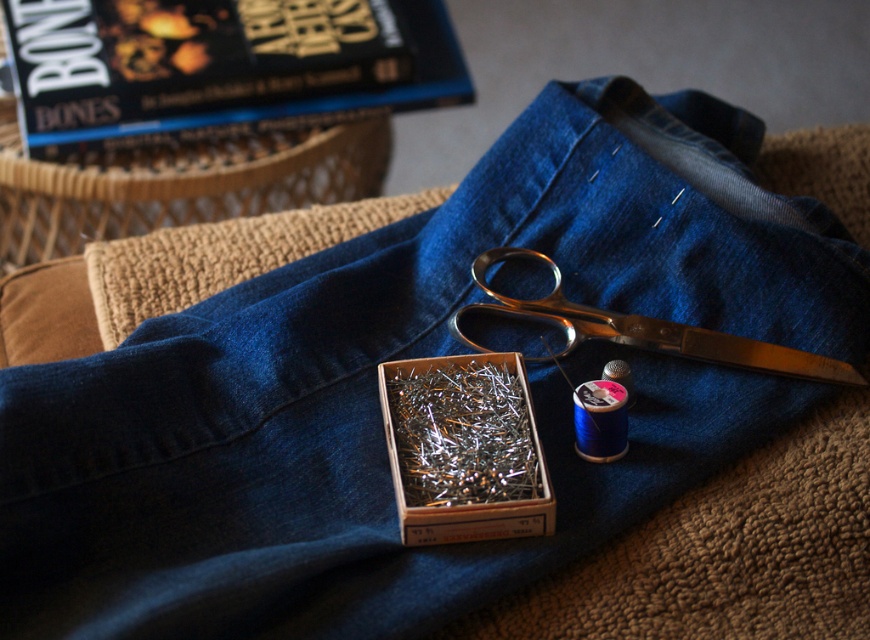
Question: Which of the following is the closest to the observer?

Choices:
 (A) wooden box filled with pins at center
 (B) polished metal scissors at center

Answer: (A)

Question: Which object is closer to the camera taking this photo?

Choices:
 (A) polished metal scissors at center
 (B) wooden box filled with pins at center

Answer: (B)

Question: Is wooden box filled with pins at center positioned before polished metal scissors at center?

Choices:
 (A) yes
 (B) no

Answer: (A)

Question: Does wooden box filled with pins at center have a greater width compared to polished metal scissors at center?

Choices:
 (A) no
 (B) yes

Answer: (A)

Question: Can you confirm if wooden box filled with pins at center is bigger than polished metal scissors at center?

Choices:
 (A) yes
 (B) no

Answer: (B)